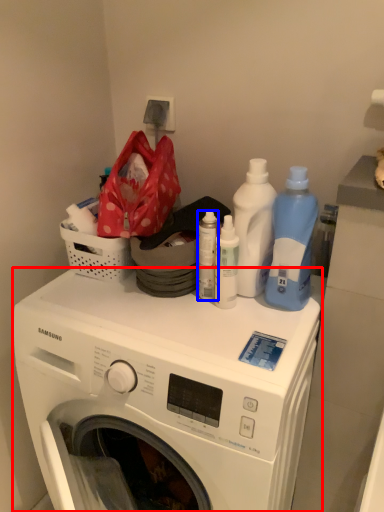
Question: Which object appears farthest to the camera in this image, washing machine (highlighted by a red box) or bottle (highlighted by a blue box)?

Choices:
 (A) washing machine
 (B) bottle

Answer: (B)